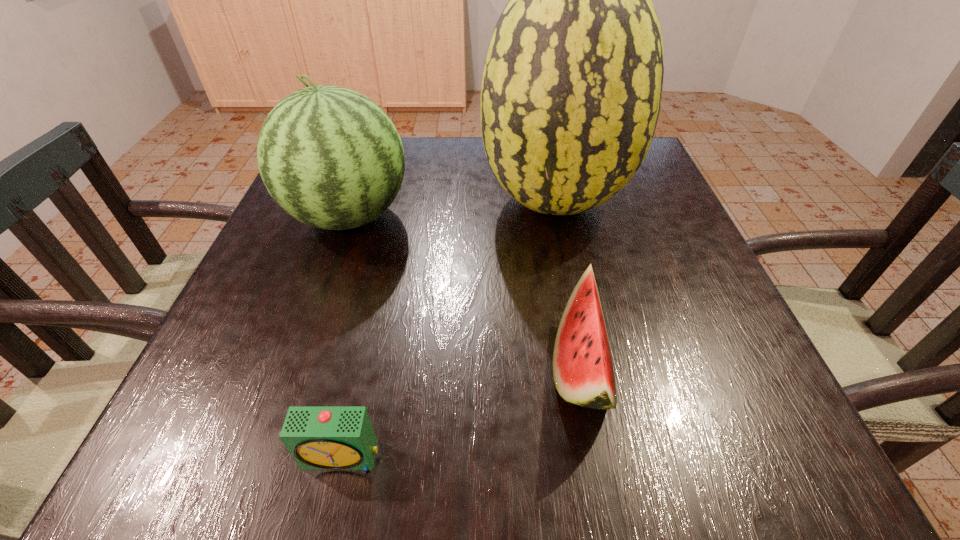
This screenshot has width=960, height=540. I want to click on vacant space that's between the leftmost watermelon and the tallest object, so click(452, 208).

Where is `object that is the closest to the second tallest object`? The height and width of the screenshot is (540, 960). object that is the closest to the second tallest object is located at coordinates (571, 91).

Locate which object is the closest to the second shortest watermelon. Please provide its 2D coordinates. Your answer should be formatted as a tuple, i.e. [(x, y)], where the tuple contains the x and y coordinates of a point satisfying the conditions above.

[(571, 91)]

Locate an element on the screen. watermelon object that ranks as the closest to the tallest object is located at coordinates (330, 157).

Choose which watermelon is the second nearest neighbor to the shortest object. Please provide its 2D coordinates. Your answer should be formatted as a tuple, i.e. [(x, y)], where the tuple contains the x and y coordinates of a point satisfying the conditions above.

[(330, 157)]

At what (x,y) coordinates should I click in order to perform the action: click on vacant space that satisfies the following two spatial constraints: 1. on the outer rind of the shortest watermelon; 2. on the front-facing side of the alarm clock. Please return your answer as a coordinate pair (x, y). Looking at the image, I should click on (598, 456).

Identify the location of free space in the image that satisfies the following two spatial constraints: 1. on the outer rind of the shortest watermelon; 2. on the front-facing side of the shortest object. The height and width of the screenshot is (540, 960). (598, 456).

Find the location of `vacant region that satisfies the following two spatial constraints: 1. on the front side of the tallest object; 2. on the outer rind of the second shortest object`. vacant region that satisfies the following two spatial constraints: 1. on the front side of the tallest object; 2. on the outer rind of the second shortest object is located at coordinates (588, 367).